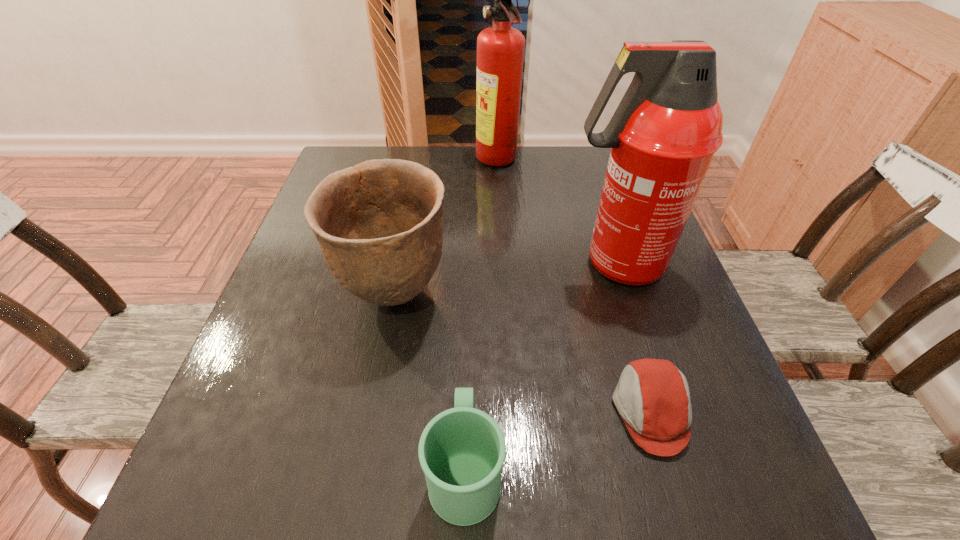
Locate an element on the screen. The image size is (960, 540). free space between the third tallest object and the right fire extinguisher is located at coordinates (505, 280).

Where is `free space between the third tallest object and the mug`? The width and height of the screenshot is (960, 540). free space between the third tallest object and the mug is located at coordinates (430, 382).

Where is `vacant space in between the right fire extinguisher and the mug`? Image resolution: width=960 pixels, height=540 pixels. vacant space in between the right fire extinguisher and the mug is located at coordinates (540, 367).

Image resolution: width=960 pixels, height=540 pixels. What are the coordinates of `free space between the pottery and the right fire extinguisher` in the screenshot? It's located at (505, 280).

You are a GUI agent. You are given a task and a screenshot of the screen. Output one action in this format:
    pyautogui.click(x=<x>, y=<y>)
    Task: Click on the vacant point located between the third shortest object and the farthest object
    
    Given the screenshot: What is the action you would take?
    pyautogui.click(x=446, y=229)

The image size is (960, 540). I want to click on free space between the shortest object and the farthest object, so click(x=574, y=287).

In order to click on unoccupied area between the pottery and the left fire extinguisher in this screenshot , I will do 446,229.

Identify the location of vacant space that is in between the left fire extinguisher and the mug. The height and width of the screenshot is (540, 960). (482, 316).

Where is `free spot between the cap and the second shortest object`? This screenshot has height=540, width=960. free spot between the cap and the second shortest object is located at coordinates (558, 440).

Locate an element on the screen. This screenshot has height=540, width=960. object that ranks as the second closest to the nearer fire extinguisher is located at coordinates (379, 224).